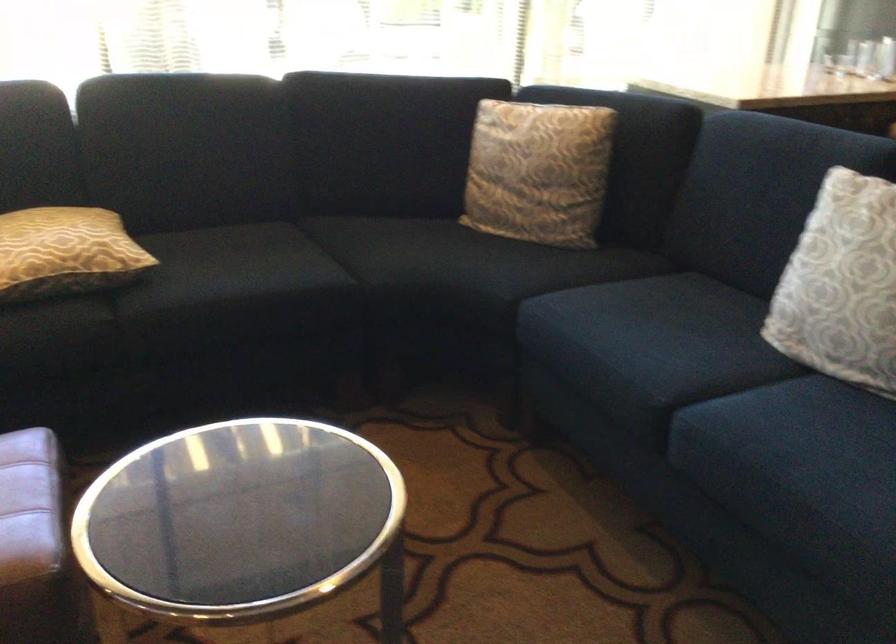
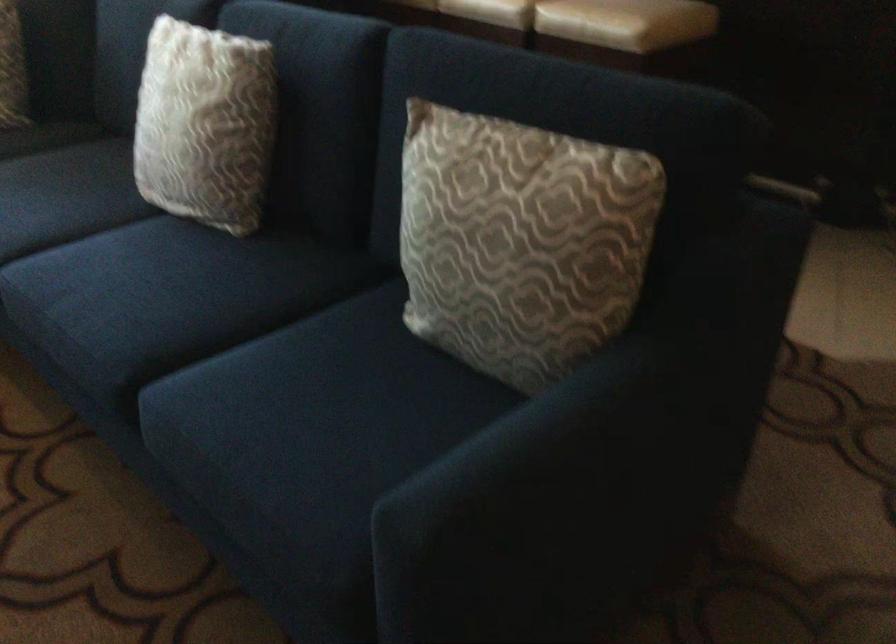
Question: The camera is either moving clockwise (left) or counter-clockwise (right) around the object. The first image is from the beginning of the video and the second image is from the end. Is the camera moving left or right when shooting the video?

Choices:
 (A) Left
 (B) Right

Answer: (A)